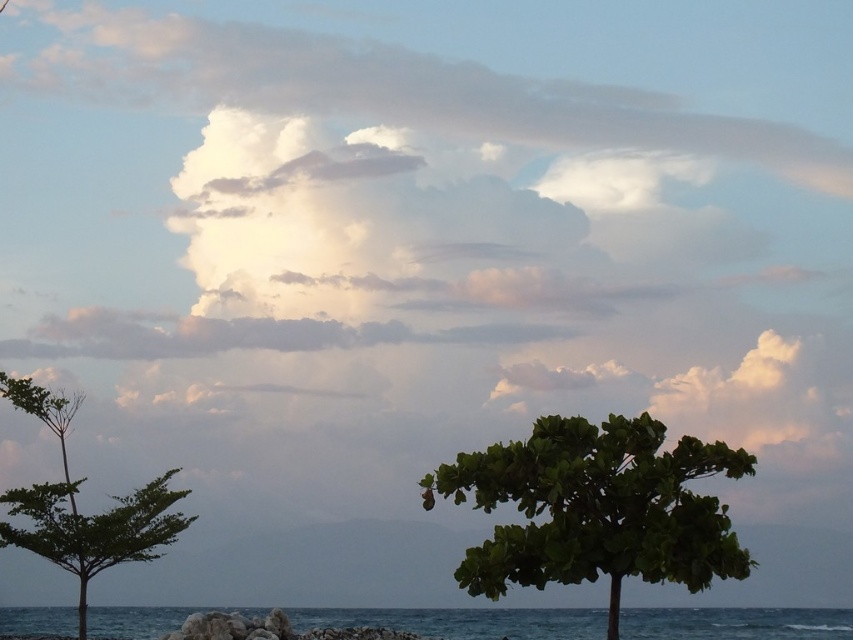
You are standing at the point marked as point (462, 621) in the coastal scene. What is the immediate environment around you?

The point (462, 621) corresponds to blue water at lower center, so you are standing in the blue water at lower center.

You are standing at the point marked by coordinates point (596, 508). Looking around, you see a green leafy tree at center. Which direction should you face to see the smaller tree on the left?

The point (596, 508) indicates the green leafy tree at center. To see the smaller tree on the left, you should face towards the left side of the scene.

You are a photographer trying to capture the white fluffy cloud at upper center in your shot. The camera you are using has a fixed focus point at coordinate point (392, 90). Will the cloud be in focus?

The white fluffy cloud at upper center is located at point (392, 90), so yes, the cloud will be in focus since the camera focuses at that exact coordinate.